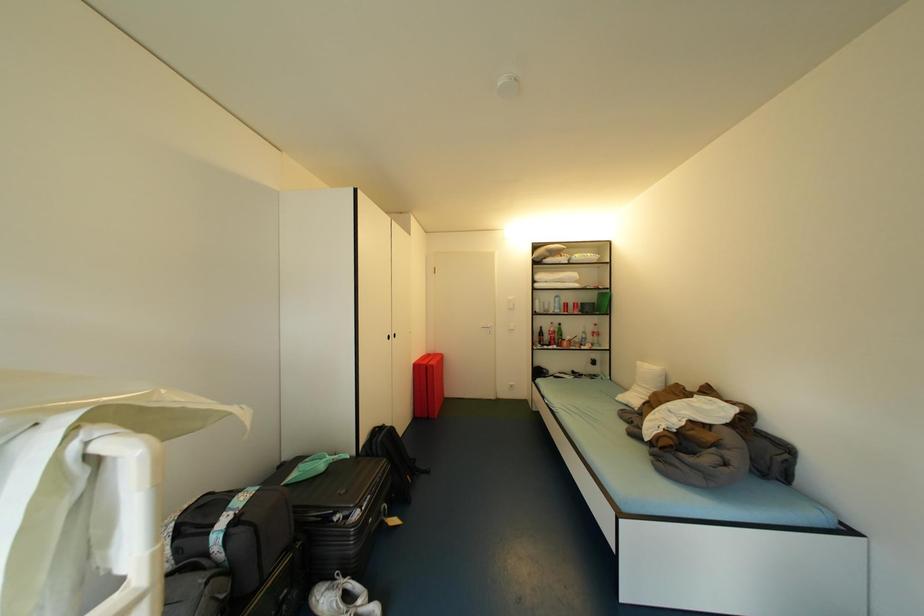
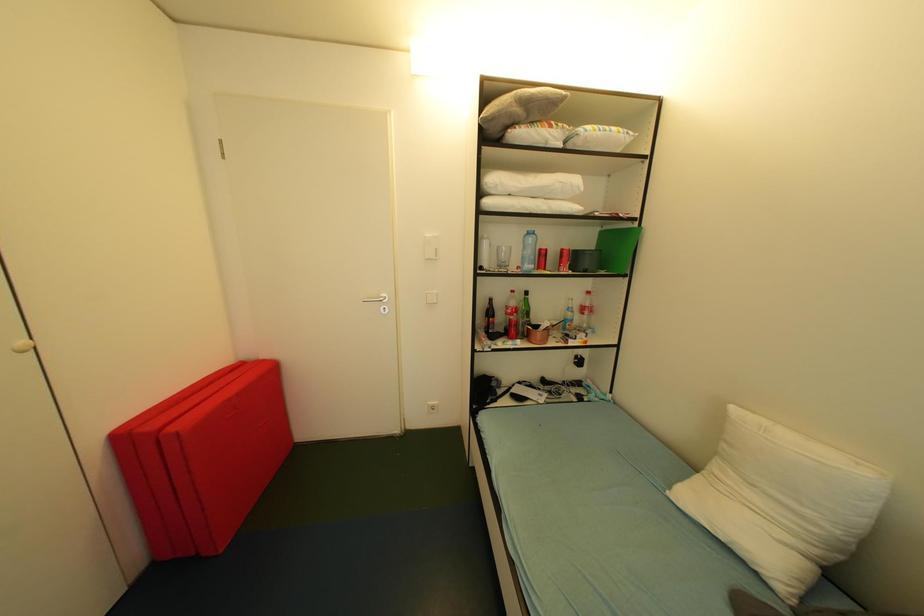
Question: The images are taken continuously from a first-person perspective. In which direction are you moving?

Choices:
 (A) Left
 (B) Right
 (C) Forward
 (D) Backward

Answer: (C)